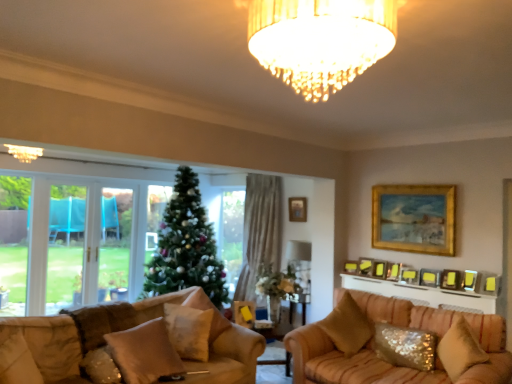
The height and width of the screenshot is (384, 512). In order to click on gold-framed picture at upper center, the fifth picture frame in the back-to-front sequence in this screenshot , I will do `click(393, 271)`.

What do you see at coordinates (208, 308) in the screenshot? I see `velvet beige pillow at center, the 4th pillow in the right-to-left sequence` at bounding box center [208, 308].

You are a GUI agent. You are given a task and a screenshot of the screen. Output one action in this format:
    pyautogui.click(x=<x>, y=<y>)
    Task: Click on the suede-like beige pillow at lower left, which is the third pillow from left to right
    Image resolution: width=512 pixels, height=384 pixels.
    Given the screenshot: What is the action you would take?
    pyautogui.click(x=145, y=353)

The width and height of the screenshot is (512, 384). I want to click on sparkly gold pillow at lower right, acting as the 8th pillow starting from the left, so click(460, 349).

The width and height of the screenshot is (512, 384). I want to click on gold-framed picture at upper center, the fifth picture frame in the back-to-front sequence, so click(x=393, y=271).

From the image's perspective, between golden crystal chandelier at center, the first light fixture when ordered from front to back, and gold-framed picture at upper center, marked as the fourth picture frame in a front-to-back arrangement, who is located below?

gold-framed picture at upper center, marked as the fourth picture frame in a front-to-back arrangement, from the image's perspective.

Does golden crystal chandelier at center, positioned as the 2th light fixture in back-to-front order, have a lesser height compared to gold-framed picture at upper center, marked as the fourth picture frame in a front-to-back arrangement?

No, golden crystal chandelier at center, positioned as the 2th light fixture in back-to-front order, is not shorter than gold-framed picture at upper center, marked as the fourth picture frame in a front-to-back arrangement.

Considering the positions of objects golden crystal chandelier at center, the first light fixture when ordered from front to back, and gold-framed picture at upper center, the fifth picture frame in the back-to-front sequence, in the image provided, who is more to the right, golden crystal chandelier at center, the first light fixture when ordered from front to back, or gold-framed picture at upper center, the fifth picture frame in the back-to-front sequence,?

Positioned to the right is gold-framed picture at upper center, the fifth picture frame in the back-to-front sequence.

Does gold metallic picture frame at upper center, placed as the 4th picture frame when sorted from back to front, have a smaller size compared to white sequined pillow at center, the fifth pillow viewed from the right?

Indeed, gold metallic picture frame at upper center, placed as the 4th picture frame when sorted from back to front, has a smaller size compared to white sequined pillow at center, the fifth pillow viewed from the right.

Considering the positions of objects gold metallic picture frame at upper center, placed as the 4th picture frame when sorted from back to front, and white sequined pillow at center, which is counted as the fourth pillow, starting from the left, in the image provided, who is behind, gold metallic picture frame at upper center, placed as the 4th picture frame when sorted from back to front, or white sequined pillow at center, which is counted as the fourth pillow, starting from the left,?

gold metallic picture frame at upper center, placed as the 4th picture frame when sorted from back to front.

Does gold metallic picture frame at upper center, positioned as the 5th picture frame in front-to-back order, turn towards white sequined pillow at center, the fifth pillow viewed from the right?

No, gold metallic picture frame at upper center, positioned as the 5th picture frame in front-to-back order, is not oriented towards white sequined pillow at center, the fifth pillow viewed from the right.

Is there a large distance between gold metallic picture frame at upper center, placed as the 4th picture frame when sorted from back to front, and white sequined pillow at center, which is counted as the fourth pillow, starting from the left?

Yes, gold metallic picture frame at upper center, placed as the 4th picture frame when sorted from back to front, and white sequined pillow at center, which is counted as the fourth pillow, starting from the left, are quite far apart.

How many degrees apart are the facing directions of matte white lampshade at center and white sequined pillow at center, the fifth pillow viewed from the right?

The angular difference between matte white lampshade at center and white sequined pillow at center, the fifth pillow viewed from the right, is 37.5 degrees.

From a real-world perspective, relative to white sequined pillow at center, which is counted as the fourth pillow, starting from the left, is matte white lampshade at center vertically above or below?

Clearly, from a real-world perspective, matte white lampshade at center is above white sequined pillow at center, which is counted as the fourth pillow, starting from the left.

In the image, is matte white lampshade at center positioned in front of or behind white sequined pillow at center, the fifth pillow viewed from the right?

Clearly, matte white lampshade at center is behind white sequined pillow at center, the fifth pillow viewed from the right.

From the picture: Considering the relative sizes of matte white lampshade at center and white sequined pillow at center, the fifth pillow viewed from the right, in the image provided, is matte white lampshade at center thinner than white sequined pillow at center, the fifth pillow viewed from the right,?

No.

From a real-world perspective, which is physically below, suede-like beige pillow at lower left, placed as the 6th pillow when sorted from right to left, or gold metallic picture frame at upper center, positioned as the 5th picture frame in front-to-back order?

suede-like beige pillow at lower left, placed as the 6th pillow when sorted from right to left, is physically lower.

Considering the sizes of objects suede-like beige pillow at lower left, placed as the 6th pillow when sorted from right to left, and gold metallic picture frame at upper center, placed as the 4th picture frame when sorted from back to front, in the image provided, who is bigger, suede-like beige pillow at lower left, placed as the 6th pillow when sorted from right to left, or gold metallic picture frame at upper center, placed as the 4th picture frame when sorted from back to front,?

suede-like beige pillow at lower left, placed as the 6th pillow when sorted from right to left, is bigger.

Is point (131, 332) closer or farther from the camera than point (373, 266)?

Point (131, 332) is closer to the camera than point (373, 266).

From the picture: Is golden crystal chandelier at center, positioned as the 2th light fixture in back-to-front order, further to camera compared to beige fabric pillow at lower left, positioned as the eighth pillow in right-to-left order?

No, golden crystal chandelier at center, positioned as the 2th light fixture in back-to-front order, is in front of beige fabric pillow at lower left, positioned as the eighth pillow in right-to-left order.

Is golden crystal chandelier at center, the first light fixture when ordered from front to back, thinner than beige fabric pillow at lower left, positioned as the eighth pillow in right-to-left order?

No, golden crystal chandelier at center, the first light fixture when ordered from front to back, is not thinner than beige fabric pillow at lower left, positioned as the eighth pillow in right-to-left order.

From a real-world perspective, is golden crystal chandelier at center, marked as the second light fixture in a left-to-right arrangement, positioned under beige fabric pillow at lower left, positioned as the eighth pillow in right-to-left order, based on gravity?

Actually, golden crystal chandelier at center, marked as the second light fixture in a left-to-right arrangement, is physically above beige fabric pillow at lower left, positioned as the eighth pillow in right-to-left order, in the real world.

Would you say golden crystal chandelier at center, the first light fixture when ordered from front to back, is to the left or to the right of beige fabric pillow at lower left, the 1th pillow from the left, in the picture?

golden crystal chandelier at center, the first light fixture when ordered from front to back, is to the right of beige fabric pillow at lower left, the 1th pillow from the left.

Which object is positioned more to the right, golden crystal chandelier at center, marked as the second light fixture in a left-to-right arrangement, or satin gold pillow at lower left, positioned as the 2th pillow in left-to-right order?

golden crystal chandelier at center, marked as the second light fixture in a left-to-right arrangement.

Is point (324, 89) positioned in front of point (98, 369)?

Yes, point (324, 89) is in front of point (98, 369).

Considering their positions, is golden crystal chandelier at center, the 1th light fixture positioned from the right, located in front of or behind satin gold pillow at lower left, positioned as the 2th pillow in left-to-right order?

Clearly, golden crystal chandelier at center, the 1th light fixture positioned from the right, is in front of satin gold pillow at lower left, positioned as the 2th pillow in left-to-right order.

Is golden crystal chandelier at center, marked as the second light fixture in a left-to-right arrangement, wider or thinner than satin gold pillow at lower left, positioned as the 2th pillow in left-to-right order?

In the image, golden crystal chandelier at center, marked as the second light fixture in a left-to-right arrangement, appears to be wider than satin gold pillow at lower left, positioned as the 2th pillow in left-to-right order.

Is white sequined pillow at center, which is counted as the fourth pillow, starting from the left, further to the viewer compared to sparkly gold pillow at lower right, the 1th pillow from the right?

Yes.

Can you see white sequined pillow at center, the fifth pillow viewed from the right, touching sparkly gold pillow at lower right, acting as the 8th pillow starting from the left?

No, white sequined pillow at center, the fifth pillow viewed from the right, is not touching sparkly gold pillow at lower right, acting as the 8th pillow starting from the left.

From the image's perspective, is white sequined pillow at center, the fifth pillow viewed from the right, located above or below sparkly gold pillow at lower right, the 1th pillow from the right?

From the image's perspective, white sequined pillow at center, the fifth pillow viewed from the right, appears above sparkly gold pillow at lower right, the 1th pillow from the right.

From a real-world perspective, count 5th picture frames downward from the golden crystal chandelier at center, the 1th light fixture positioned from the right, and point to it. Please provide its 2D coordinates.

[(393, 271)]

Identify the location of the 5th picture frame behind when counting from the white sequined pillow at center, which is counted as the fourth pillow, starting from the left. (380, 269).

Based on their spatial positions, is matte gold picture frame at upper right, placed as the 3th picture frame when sorted from back to front, or suede-like beige pillow at lower left, which is the third pillow from left to right, closer to sparkly gold pillow at lower right, the 1th pillow from the right?

Among the two, matte gold picture frame at upper right, placed as the 3th picture frame when sorted from back to front, is located nearer to sparkly gold pillow at lower right, the 1th pillow from the right.

From the image, which object appears to be nearer to gold metallic picture frame at upper center, positioned as the 5th picture frame in front-to-back order, velvet beige pillow at center, which ranks as the fifth pillow in left-to-right order, or gold-framed picture at upper center, arranged as the first picture frame when viewed from the back?

Based on the image, gold-framed picture at upper center, arranged as the first picture frame when viewed from the back, appears to be nearer to gold metallic picture frame at upper center, positioned as the 5th picture frame in front-to-back order.

From the image, which object appears to be farther from sequined fabric pillow at lower right, the 2th pillow from the right, yellow matte picture frame at upper right, acting as the third picture frame starting from the front, or velvet beige pillow at center, the 4th pillow in the right-to-left sequence?

velvet beige pillow at center, the 4th pillow in the right-to-left sequence, is positioned further to the anchor sequined fabric pillow at lower right, the 2th pillow from the right.

Considering their positions, is golden crystal chandelier at center, positioned as the 2th light fixture in back-to-front order, positioned closer to matte white lampshade at center than matte gold picture frame at upper right, placed as the 3th picture frame when sorted from back to front?

Among the two, matte gold picture frame at upper right, placed as the 3th picture frame when sorted from back to front, is located nearer to matte white lampshade at center.

Looking at the image, which one is located closer to suede-like beige pillow at lower left, placed as the 6th pillow when sorted from right to left, white sequined pillow at center, which is counted as the fourth pillow, starting from the left, or gold-framed picture at upper center, the fifth picture frame in the back-to-front sequence?

The object closer to suede-like beige pillow at lower left, placed as the 6th pillow when sorted from right to left, is white sequined pillow at center, which is counted as the fourth pillow, starting from the left.

Looking at the image, which one is located closer to velvet beige pillow at center, the 4th pillow in the right-to-left sequence, beige fabric pillow at lower left, the 1th pillow from the left, or white sequined pillow at center, the fifth pillow viewed from the right?

Based on the image, white sequined pillow at center, the fifth pillow viewed from the right, appears to be nearer to velvet beige pillow at center, the 4th pillow in the right-to-left sequence.

From the image, which object appears to be nearer to sparkly gold pillow at lower right, acting as the 8th pillow starting from the left, velvet beige pillow at center, which ranks as the fifth pillow in left-to-right order, or matte gold picture frame at upper right, placed as the 3th picture frame when sorted from back to front?

velvet beige pillow at center, which ranks as the fifth pillow in left-to-right order, lies closer to sparkly gold pillow at lower right, acting as the 8th pillow starting from the left, than the other object.

Consider the image. Looking at the image, which one is located further to gold-framed picture at upper center, arranged as the first picture frame when viewed from the back, matte gold picture frame at upper right, which appears as the sixth picture frame when viewed from the front, or yellow matte picture frame at upper right, the sixth picture frame positioned from the back?

The object further to gold-framed picture at upper center, arranged as the first picture frame when viewed from the back, is yellow matte picture frame at upper right, the sixth picture frame positioned from the back.

Where is `lamp between gold-framed painting at upper right, which is the 7th picture frame from back to front, and gold-framed picture at upper center, arranged as the first picture frame when viewed from the back, from front to back`? This screenshot has width=512, height=384. lamp between gold-framed painting at upper right, which is the 7th picture frame from back to front, and gold-framed picture at upper center, arranged as the first picture frame when viewed from the back, from front to back is located at coordinates 300,263.

Where is `light fixture between golden crystal chandelier at center, positioned as the 2th light fixture in back-to-front order, and matte white lampshade at center from front to back`? The height and width of the screenshot is (384, 512). light fixture between golden crystal chandelier at center, positioned as the 2th light fixture in back-to-front order, and matte white lampshade at center from front to back is located at coordinates (24, 152).

Locate an element on the screen. The width and height of the screenshot is (512, 384). light fixture between matte gold chandelier at upper center, acting as the 2th light fixture starting from the front, and gold-framed picture at upper center, the fifth picture frame in the back-to-front sequence is located at coordinates (320, 40).

You are a GUI agent. You are given a task and a screenshot of the screen. Output one action in this format:
    pyautogui.click(x=<x>, y=<y>)
    Task: Click on the lamp situated between matte gold chandelier at upper center, the first light fixture from the back, and sparkly gold pillow at lower right, acting as the 8th pillow starting from the left, from left to right
    This screenshot has width=512, height=384.
    Given the screenshot: What is the action you would take?
    pyautogui.click(x=300, y=263)